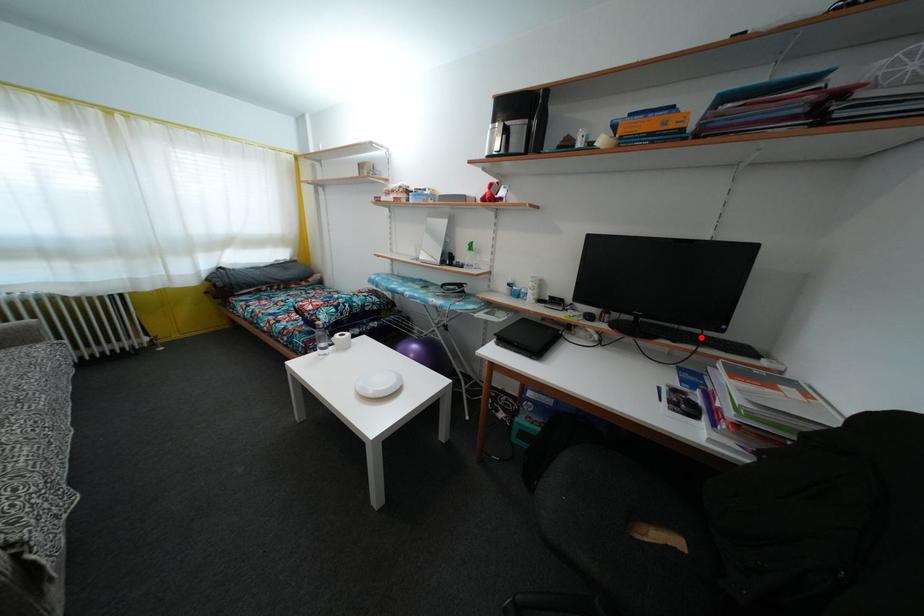
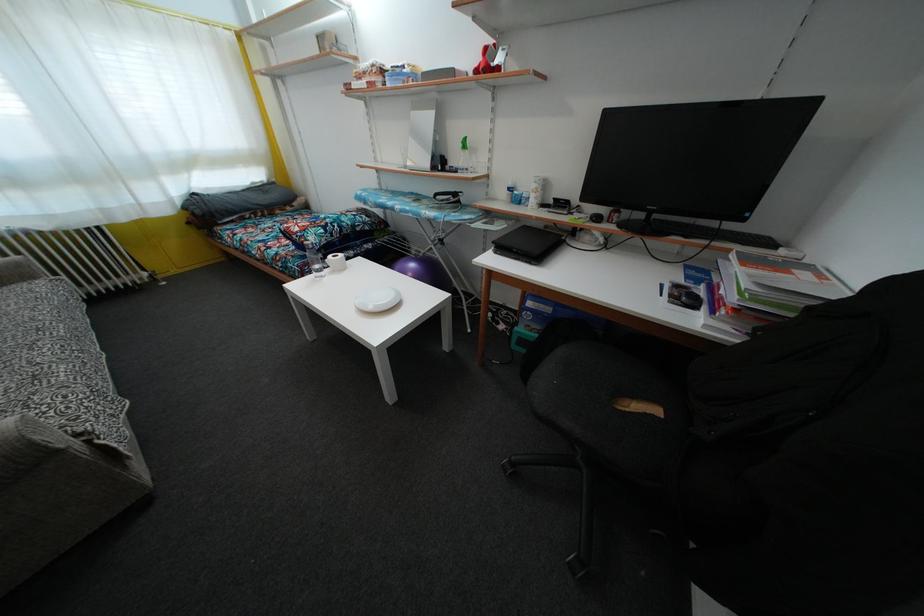
The point at the highlighted location is marked in the first image. Where is the corresponding point in the second image?

(719, 230)